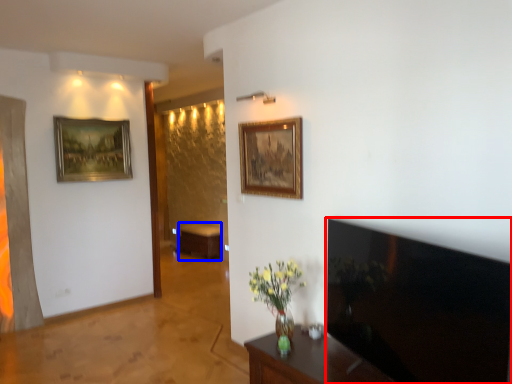
Question: Among these objects, which one is nearest to the camera, television (highlighted by a red box) or table (highlighted by a blue box)?

Choices:
 (A) television
 (B) table

Answer: (A)